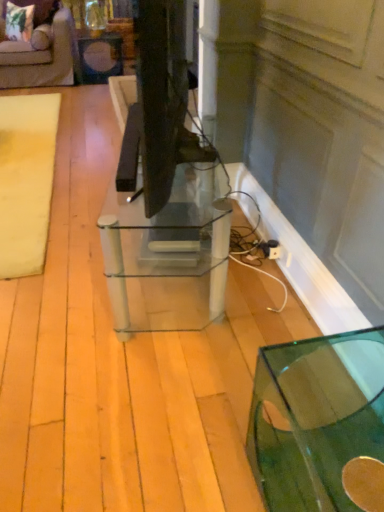
Question: From the image's perspective, is clear glass table at center, which is counted as the second table, starting from the bottom, located above or below velvet beige sofa at upper left?

Choices:
 (A) below
 (B) above

Answer: (A)

Question: Is clear glass table at center, the 1th table when ordered from back to front, taller or shorter than velvet beige sofa at upper left?

Choices:
 (A) short
 (B) tall

Answer: (A)

Question: Estimate the real-world distances between objects in this image. Which object is farther from the velvet beige sofa at upper left?

Choices:
 (A) transparent glass table at lower right, marked as the second table in a back-to-front arrangement
 (B) beige fabric mat at left
 (C) matte black side table at upper left
 (D) clear glass table at center, arranged as the first table when viewed from the left

Answer: (A)

Question: Which is nearer to the matte black side table at upper left?

Choices:
 (A) clear glass table at center, the 1th table when ordered from back to front
 (B) velvet beige sofa at upper left
 (C) beige fabric mat at left
 (D) transparent glass table at lower right, marked as the 1th table in a front-to-back arrangement

Answer: (B)